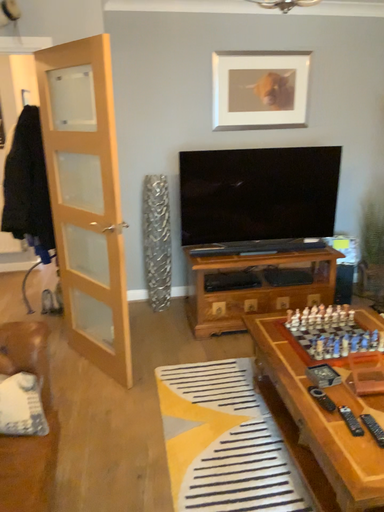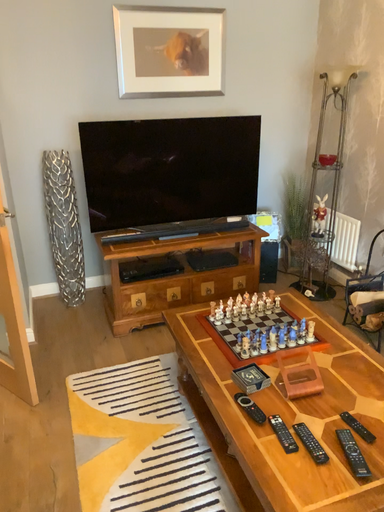
Question: Which way did the camera rotate in the video?

Choices:
 (A) rotated right
 (B) rotated left

Answer: (A)